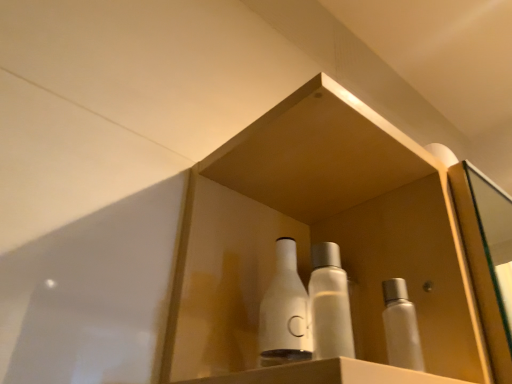
What are the coordinates of `free space above white glossy bottles at center (from a real-world perspective)` in the screenshot? It's located at (311, 167).